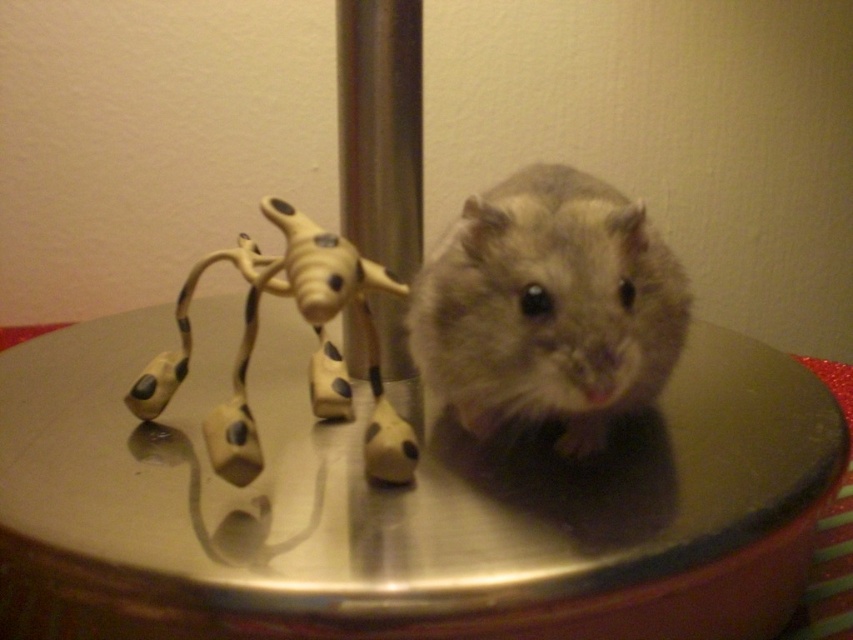
Question: Which of the following is the farthest from the observer?

Choices:
 (A) (636, 284)
 (B) (142, 413)

Answer: (B)

Question: Among these points, which one is farthest from the camera?

Choices:
 (A) (393, 477)
 (B) (671, 276)

Answer: (B)

Question: Which object is farther from the camera taking this photo?

Choices:
 (A) fuzzy gray mouse at center
 (B) tan matte plastic toy at left

Answer: (A)

Question: Is fuzzy gray mouse at center to the right of tan matte plastic toy at left from the viewer's perspective?

Choices:
 (A) no
 (B) yes

Answer: (B)

Question: Is fuzzy gray mouse at center positioned behind tan matte plastic toy at left?

Choices:
 (A) yes
 (B) no

Answer: (A)

Question: Is fuzzy gray mouse at center smaller than tan matte plastic toy at left?

Choices:
 (A) no
 (B) yes

Answer: (B)